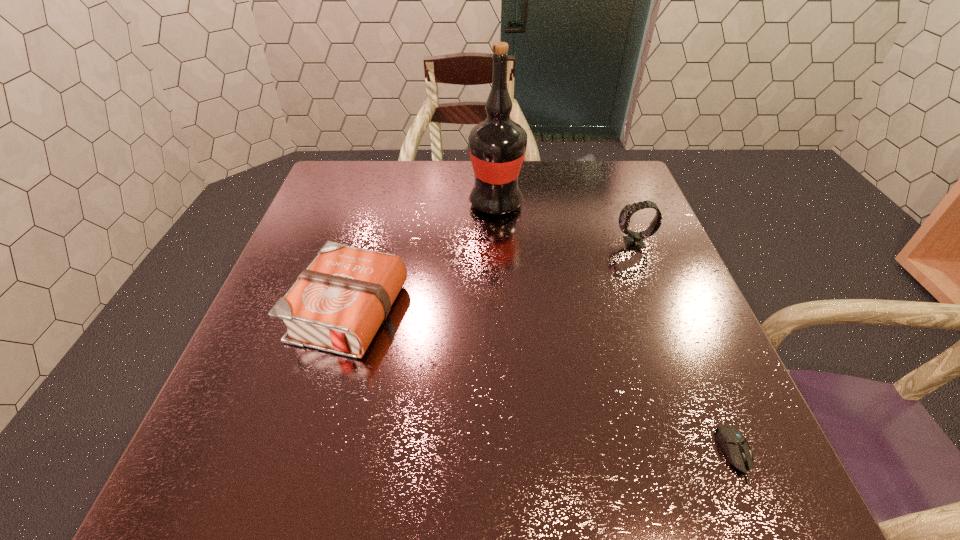
You are a GUI agent. You are given a task and a screenshot of the screen. Output one action in this format:
    pyautogui.click(x=<x>, y=<y>)
    Task: Click on the third object from right to left
    The width and height of the screenshot is (960, 540).
    Given the screenshot: What is the action you would take?
    pyautogui.click(x=497, y=146)

This screenshot has height=540, width=960. I want to click on the farthest object, so click(497, 146).

The height and width of the screenshot is (540, 960). What are the coordinates of `watch` in the screenshot? It's located at (634, 239).

Where is `the third nearest object`? the third nearest object is located at coordinates (634, 239).

The height and width of the screenshot is (540, 960). Find the location of `the leftmost object`. the leftmost object is located at coordinates (337, 304).

Locate an element on the screen. The height and width of the screenshot is (540, 960). Bible is located at coordinates (337, 304).

The width and height of the screenshot is (960, 540). In order to click on computer mouse in this screenshot , I will do click(734, 444).

Locate an element on the screen. The height and width of the screenshot is (540, 960). the shortest object is located at coordinates (734, 444).

Locate an element on the screen. vacant space situated on the right of the second object from left to right is located at coordinates (549, 204).

Locate an element on the screen. This screenshot has height=540, width=960. vacant space located on the face of the third shortest object is located at coordinates (583, 243).